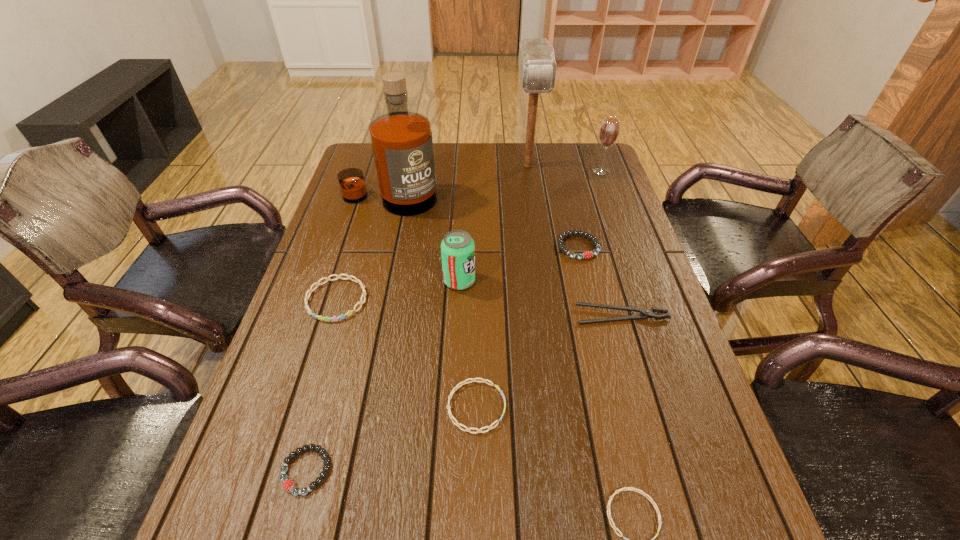
Where is `the eighth farthest object`? This screenshot has height=540, width=960. the eighth farthest object is located at coordinates (462, 383).

At what (x,y) coordinates should I click in order to perform the action: click on the second nearest blue bracelet. Please return your answer as a coordinate pair (x, y). Looking at the image, I should click on (462, 383).

You are a GUI agent. You are given a task and a screenshot of the screen. Output one action in this format:
    pyautogui.click(x=<x>, y=<y>)
    Task: Click on the smaller black bracelet
    The width and height of the screenshot is (960, 540).
    Given the screenshot: What is the action you would take?
    pyautogui.click(x=288, y=485)

This screenshot has height=540, width=960. What are the coordinates of `the left black bracelet` in the screenshot? It's located at (288, 485).

Locate an element on the screen. The image size is (960, 540). vacant point located 0.070m on the striking face of the mallet is located at coordinates (532, 193).

Locate an element on the screen. The image size is (960, 540). free space located on the front label of the liquor is located at coordinates (367, 291).

Where is `vacant region located 0.160m on the left of the wineglass`? vacant region located 0.160m on the left of the wineglass is located at coordinates (544, 171).

You are a GUI agent. You are given a task and a screenshot of the screen. Output one action in this format:
    pyautogui.click(x=<x>, y=<y>)
    Task: Click on the vacant region located 0.070m on the front-facing side of the seventh shortest object
    
    Given the screenshot: What is the action you would take?
    pyautogui.click(x=502, y=281)

Locate an element on the screen. This screenshot has height=540, width=960. free space located on the surface of the leftmost blue bracelet showing star-shaped elements is located at coordinates (311, 381).

Locate an element on the screen. vacant point located 0.050m on the back of the bigger black bracelet is located at coordinates (572, 222).